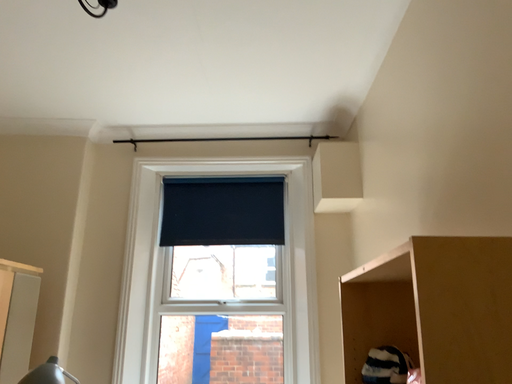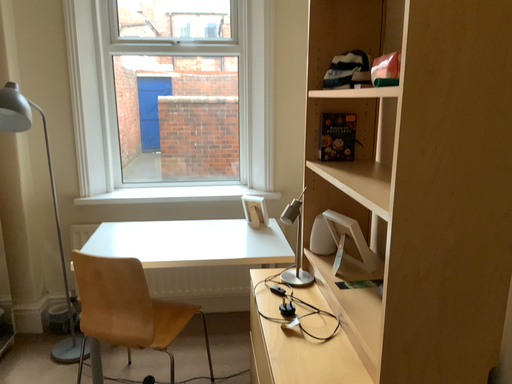
Question: How did the camera likely rotate when shooting the video?

Choices:
 (A) rotated upward
 (B) rotated downward

Answer: (B)